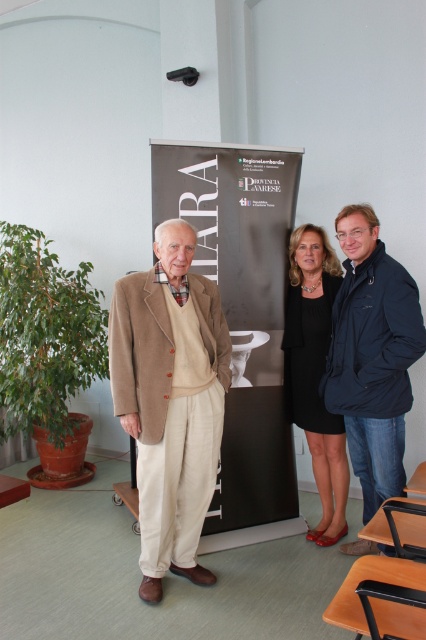
You are a photographer standing 10 feet away from the two people wearing the dark blue jacket at center and the black satin dress at center. You want to take a photo of both of them without any part of their clothing overlapping in the frame. Is this possible given their current positions?

The dark blue jacket at center is 12.09 inches from the black satin dress at center. Since the photographer is 10 feet away, the distance between them is sufficient to capture both without overlapping, so yes, it is possible.

You are standing at the origin point in the image. Which of the two points, point (196, 294) or point (367, 436), is closer to you?

Point (196, 294) is closer to you because it is in front of point (367, 436).